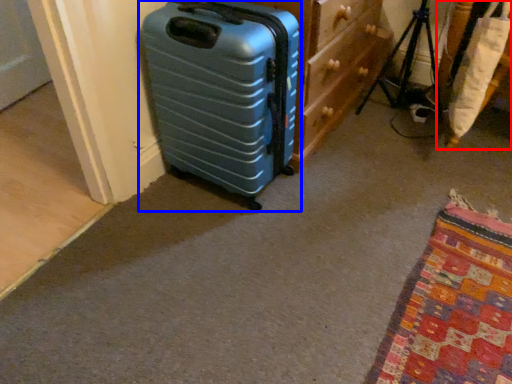
Question: Which object is further to the camera taking this photo, furniture (highlighted by a red box) or suitcase (highlighted by a blue box)?

Choices:
 (A) furniture
 (B) suitcase

Answer: (A)